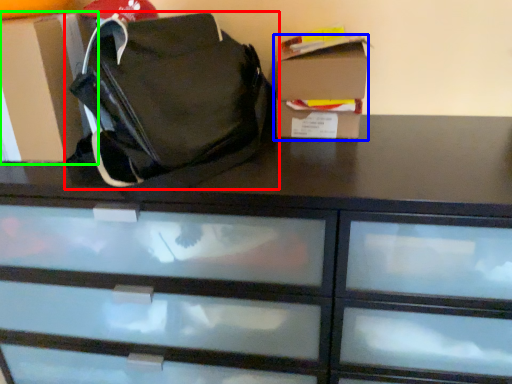
Question: Which is nearer to the handbag (highlighted by a red box)? storage box (highlighted by a blue box) or cardboard box (highlighted by a green box).

Choices:
 (A) storage box
 (B) cardboard box

Answer: (B)